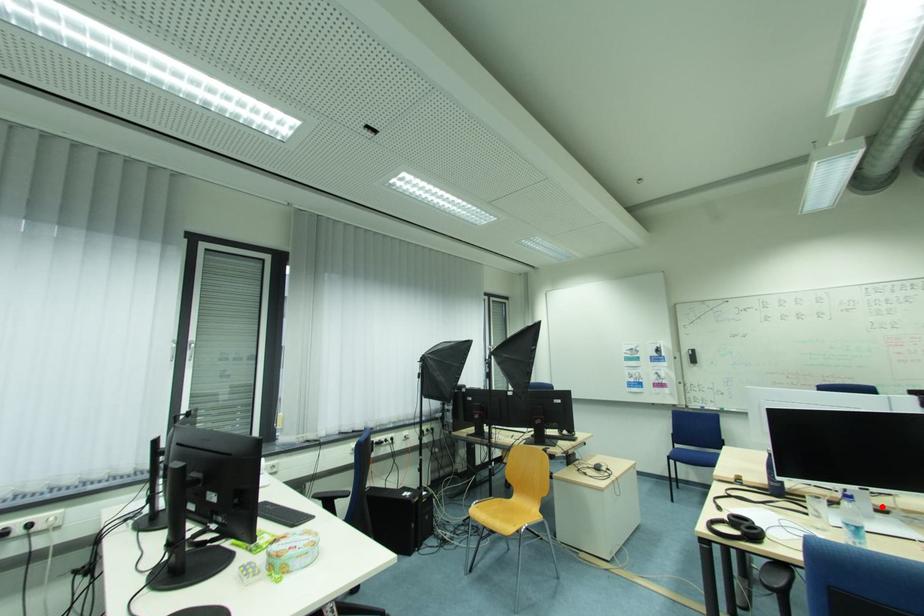
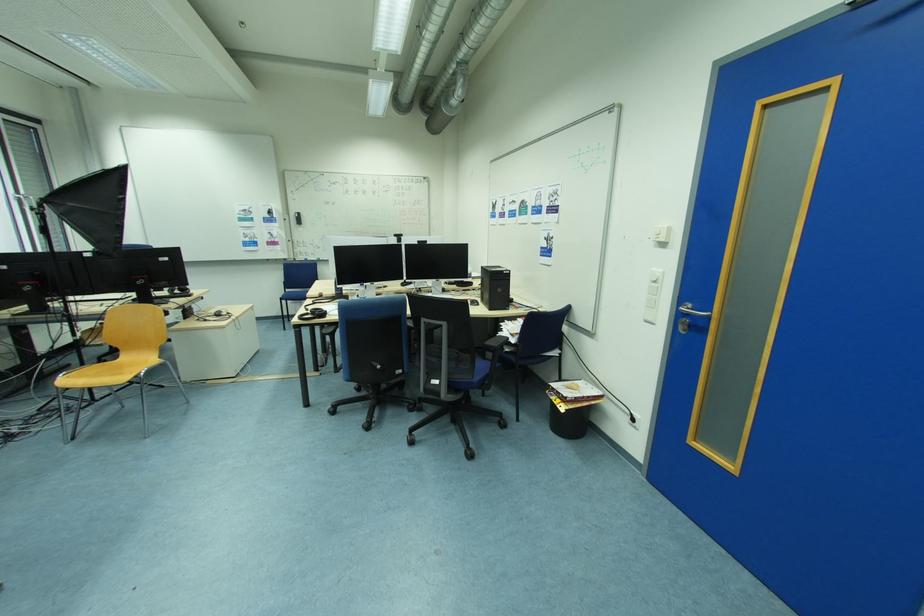
Locate, in the second image, the point that corresponds to the highlighted location in the first image.

(383, 293)